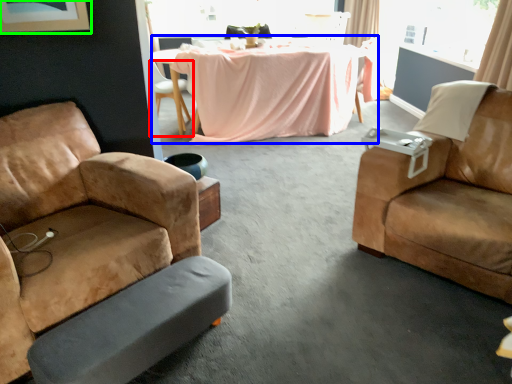
Question: Which object is the farthest from chair (highlighted by a red box)? Choose among these: table (highlighted by a blue box) or picture frame (highlighted by a green box).

Choices:
 (A) table
 (B) picture frame

Answer: (B)